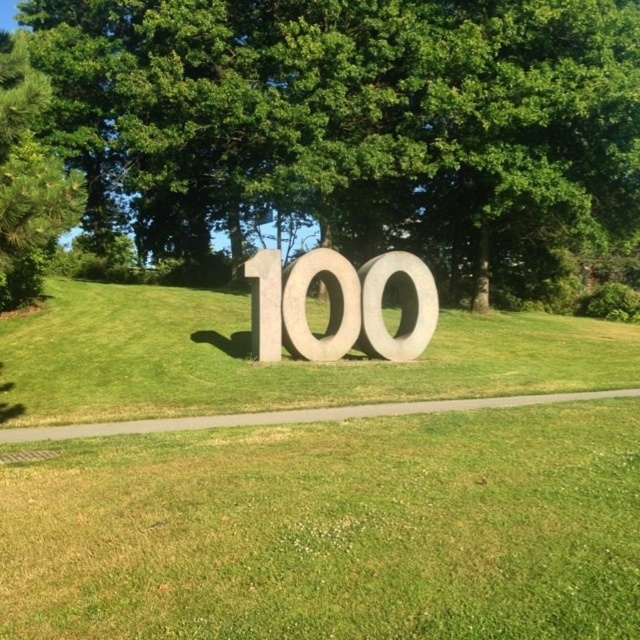
Question: Is green grass at center smaller than green leafy tree at center?

Choices:
 (A) no
 (B) yes

Answer: (B)

Question: Is smooth stone number at center to the right of gray stone letter at center from the viewer's perspective?

Choices:
 (A) no
 (B) yes

Answer: (B)

Question: Among these objects, which one is nearest to the camera?

Choices:
 (A) green grass at center
 (B) gray stone letter at center
 (C) metallic gray number at center
 (D) sanded concrete number at center

Answer: (A)

Question: Which point is farther from the camera taking this photo?

Choices:
 (A) (276, 268)
 (B) (557, 99)
 (C) (12, 298)

Answer: (B)

Question: Which is farther from the smooth stone number at center?

Choices:
 (A) metallic gray number at center
 (B) green leafy tree at center

Answer: (B)

Question: Observing the image, what is the correct spatial positioning of green pine at left in reference to gray stone letter at center?

Choices:
 (A) left
 (B) right

Answer: (A)